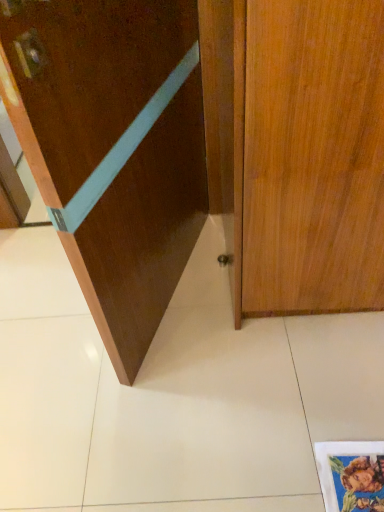
I want to click on vacant area on top of matte paper at lower right (from a real-world perspective), so click(356, 476).